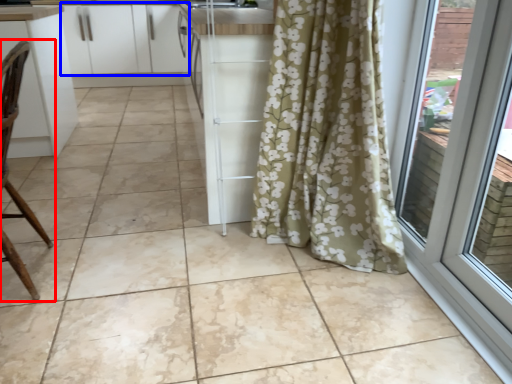
Question: Which object appears closest to the camera in this image, chair (highlighted by a red box) or cabinetry (highlighted by a blue box)?

Choices:
 (A) chair
 (B) cabinetry

Answer: (A)